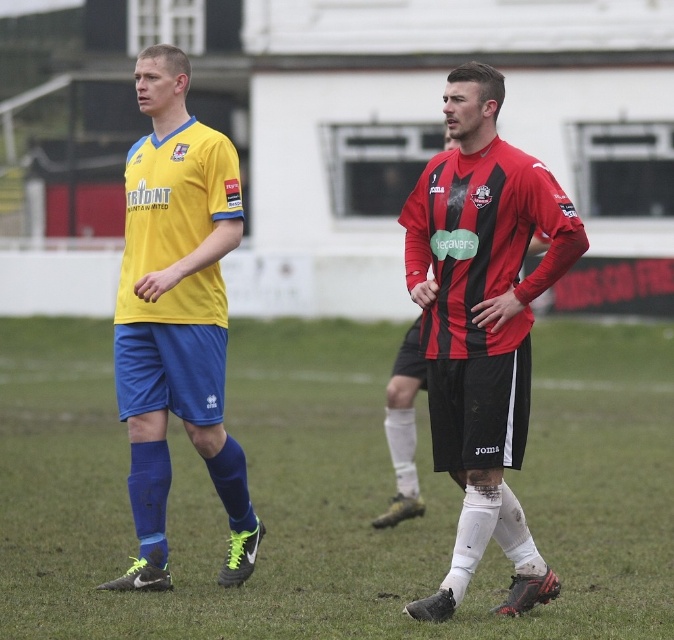
Question: Among these objects, which one is nearest to the camera?

Choices:
 (A) yellow matte jersey at left
 (B) green grass at center
 (C) yellow matte jersey at center

Answer: (B)

Question: From the image, what is the correct spatial relationship of green grass at center in relation to matte red and black jersey at center?

Choices:
 (A) left
 (B) right

Answer: (A)

Question: Does green grass at center have a larger size compared to yellow matte jersey at left?

Choices:
 (A) no
 (B) yes

Answer: (B)

Question: Is green grass at center in front of yellow matte jersey at center?

Choices:
 (A) yes
 (B) no

Answer: (A)

Question: Which point is closer to the camera?

Choices:
 (A) (543, 595)
 (B) (135, 497)
 (C) (520, 451)
 (D) (42, 328)

Answer: (C)

Question: Considering the real-world distances, which object is closest to the yellow matte jersey at center?

Choices:
 (A) green grass at center
 (B) yellow matte jersey at left

Answer: (B)